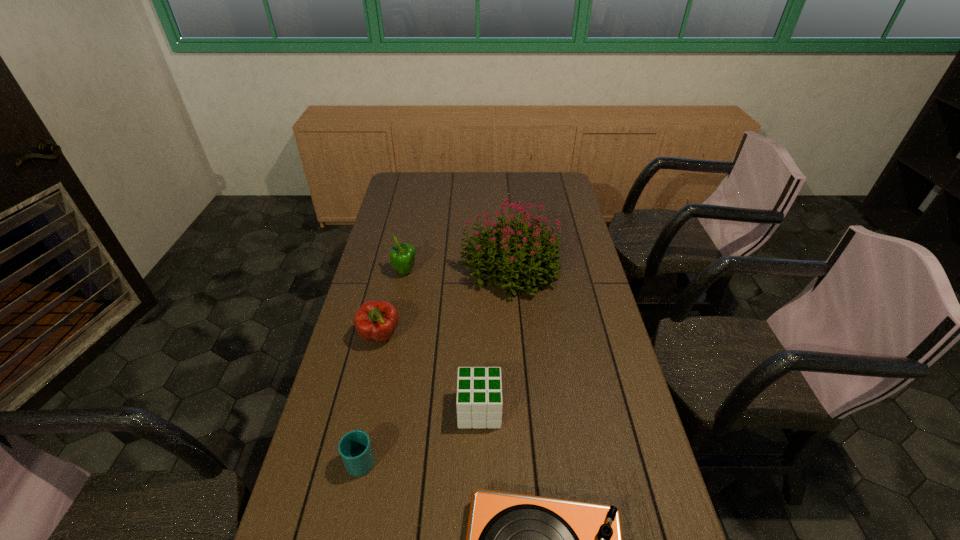
At what (x,y) coordinates should I click in order to perform the action: click on vacant area situated 0.290m on the handle side of the cup. Please return your answer as a coordinate pair (x, y). This screenshot has width=960, height=540. Looking at the image, I should click on (384, 353).

Locate an element on the screen. This screenshot has width=960, height=540. vacant point located 0.170m on the handle side of the cup is located at coordinates (376, 385).

The width and height of the screenshot is (960, 540). Identify the location of free space located on the handle side of the cup. (371, 413).

At what (x,y) coordinates should I click in order to perform the action: click on cup present at the left edge. Please return your answer as a coordinate pair (x, y). Image resolution: width=960 pixels, height=540 pixels. Looking at the image, I should click on (355, 449).

This screenshot has width=960, height=540. What are the coordinates of `object at the right edge` in the screenshot? It's located at (x=539, y=255).

I want to click on vacant space at the far edge of the desktop, so click(468, 181).

Where is `free space at the left edge`? The height and width of the screenshot is (540, 960). free space at the left edge is located at coordinates (376, 270).

The image size is (960, 540). I want to click on vacant region at the right edge of the desktop, so click(x=603, y=405).

Where is `vacant space at the far left corner of the desktop`? This screenshot has height=540, width=960. vacant space at the far left corner of the desktop is located at coordinates (405, 181).

What are the coordinates of `free space at the far right corner of the desktop` in the screenshot? It's located at (569, 191).